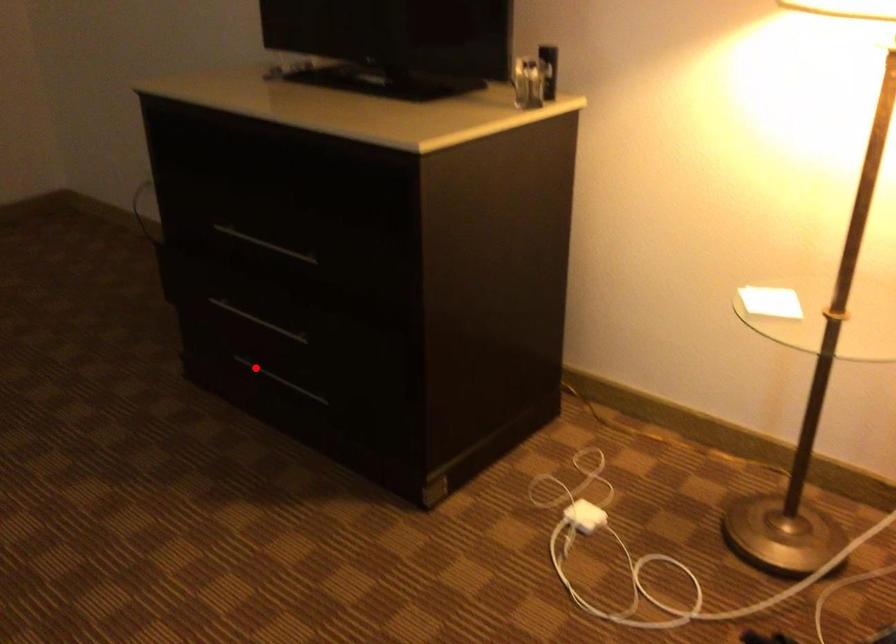
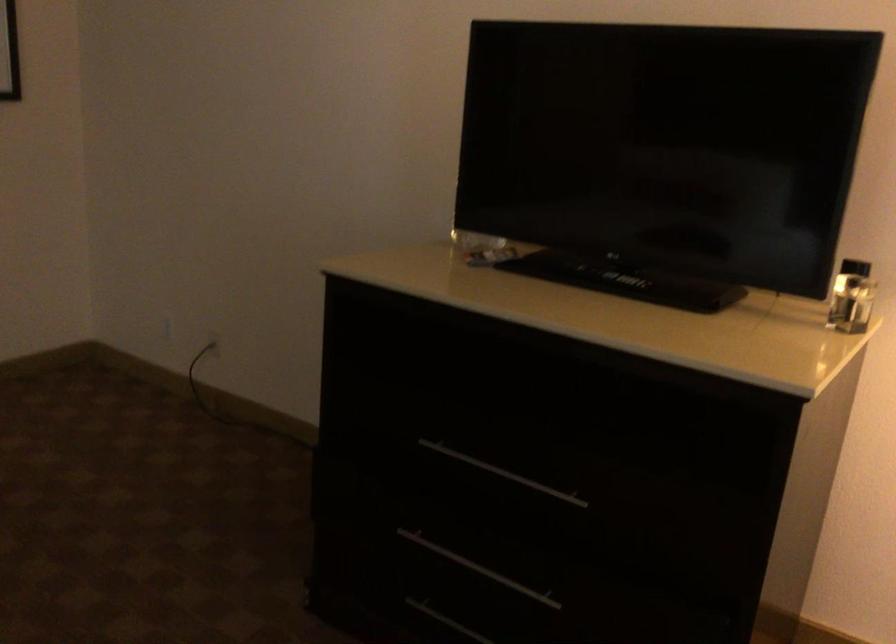
Question: I am providing you with two images of the same scene from different viewpoints. A red point is shown in image1. For the corresponding object point in image2, is it positioned nearer or farther from the camera?

Choices:
 (A) Nearer
 (B) Farther

Answer: (A)